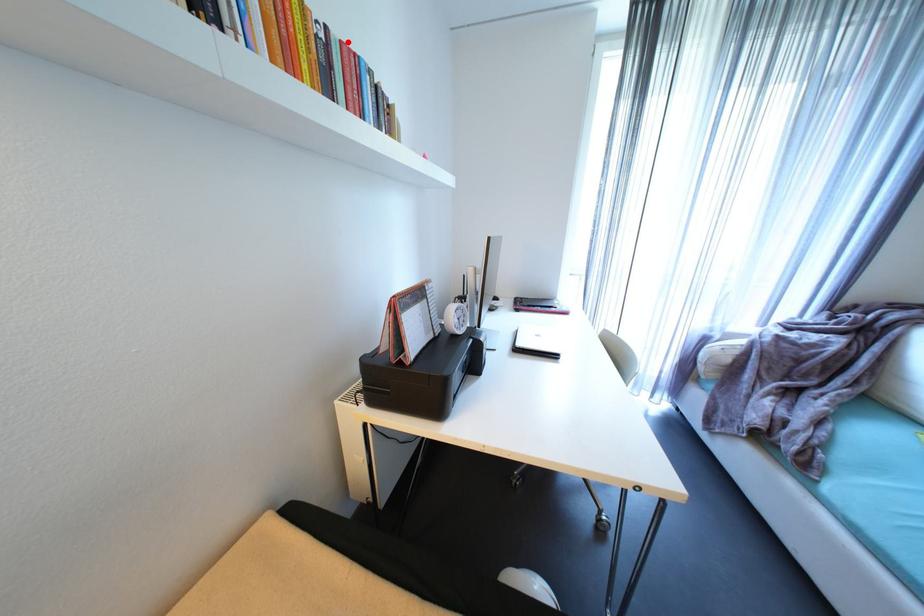
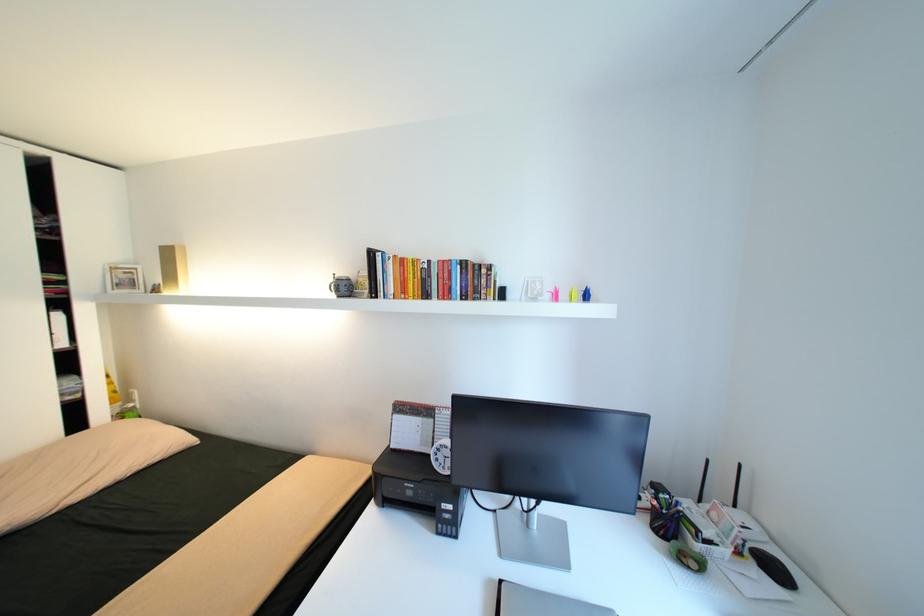
Find the pixel in the second image that matches the highlighted location in the first image.

(445, 262)